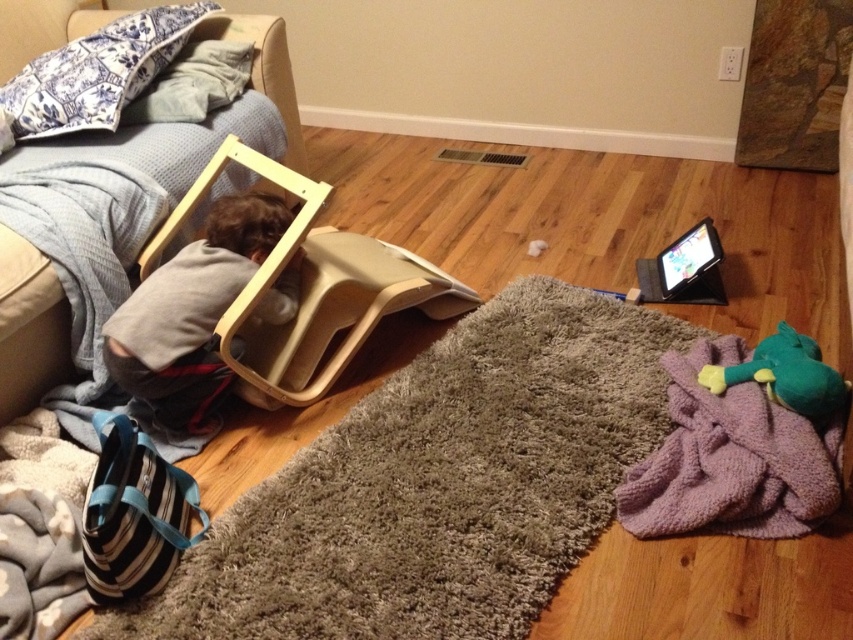
Question: Which point is closer to the camera?

Choices:
 (A) brown furry cat at left
 (B) purple fuzzy blanket at lower right
 (C) blue toile fabric pillow at upper left
 (D) purple soft blanket at lower right

Answer: (D)

Question: Can you confirm if purple soft blanket at lower right is positioned to the left of light brown fabric couch at left?

Choices:
 (A) yes
 (B) no

Answer: (B)

Question: Which of the following is the farthest from the observer?

Choices:
 (A) (126, 384)
 (B) (67, 118)

Answer: (B)

Question: Which point is closer to the camera taking this photo?

Choices:
 (A) (457, 636)
 (B) (102, 70)

Answer: (A)

Question: Is light brown fabric couch at left thinner than blue toile fabric pillow at upper left?

Choices:
 (A) yes
 (B) no

Answer: (A)

Question: Where is brown furry cat at left located in relation to blue printed fabric pillow at upper left in the image?

Choices:
 (A) left
 (B) right

Answer: (B)